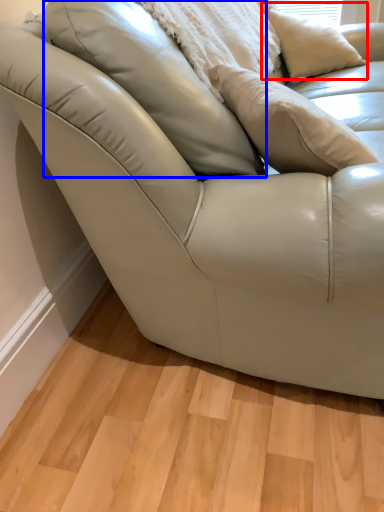
Question: Among these objects, which one is nearest to the camera, pillow (highlighted by a red box) or pillow (highlighted by a blue box)?

Choices:
 (A) pillow
 (B) pillow

Answer: (B)